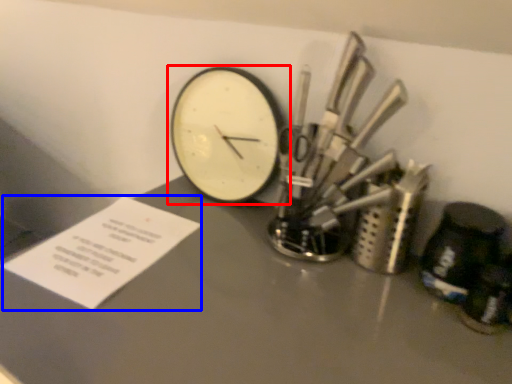
Question: Among these objects, which one is farthest to the camera, wall clock (highlighted by a red box) or paper (highlighted by a blue box)?

Choices:
 (A) wall clock
 (B) paper

Answer: (A)